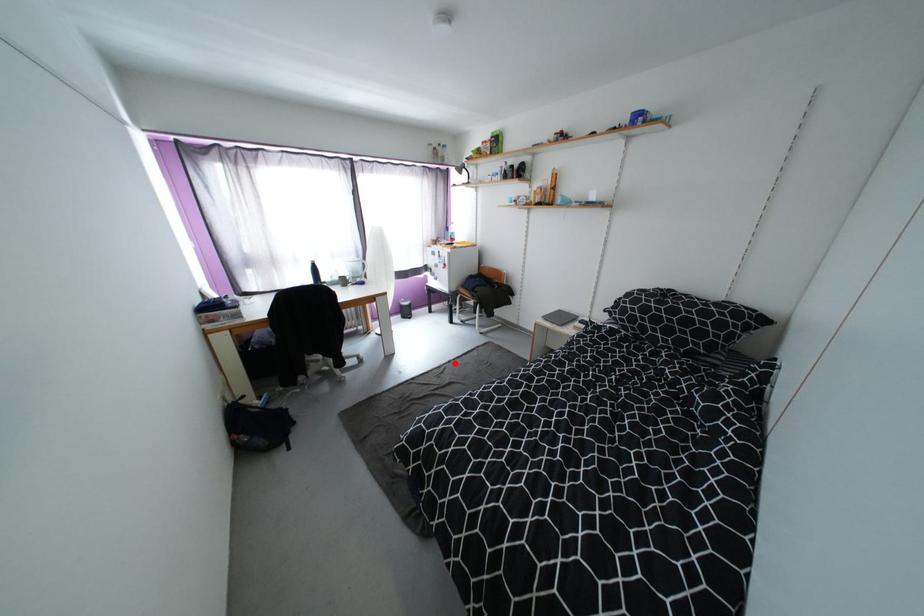
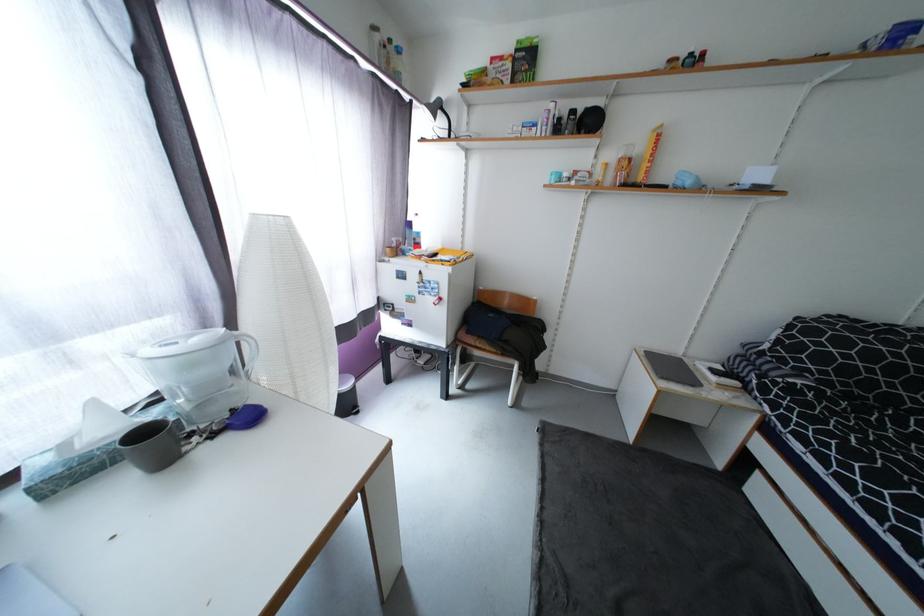
In the second image, find the point that corresponds to the highlighted location in the first image.

(548, 524)